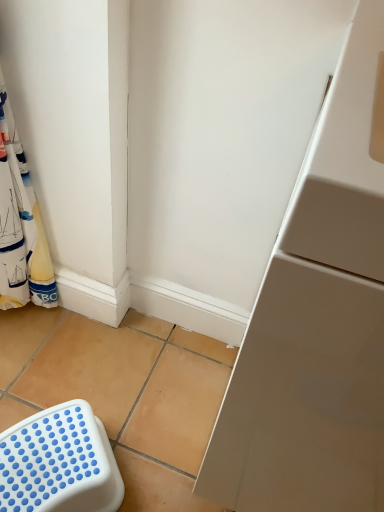
Where is `free space above white plastic stool at lower left (from a real-world perspective)`? free space above white plastic stool at lower left (from a real-world perspective) is located at coordinates (59, 454).